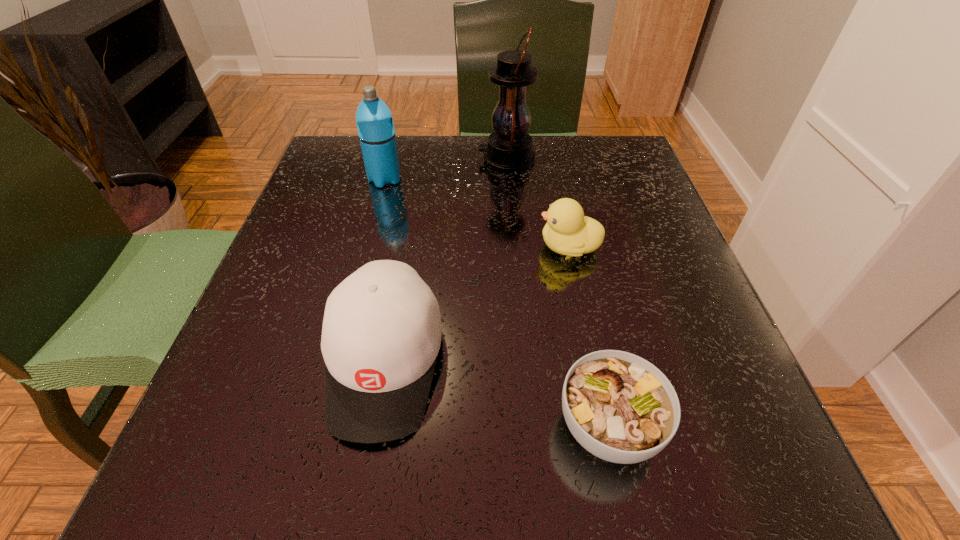
At what (x,y) coordinates should I click in order to perform the action: click on baseball cap at the left edge. Please return your answer as a coordinate pair (x, y). Looking at the image, I should click on (381, 334).

You are a GUI agent. You are given a task and a screenshot of the screen. Output one action in this format:
    pyautogui.click(x=<x>, y=<y>)
    Task: Click on the duckling that is at the right edge
    
    Given the screenshot: What is the action you would take?
    pyautogui.click(x=568, y=232)

What are the coordinates of `soup bowl present at the right edge` in the screenshot? It's located at (621, 408).

Where is `object positioned at the far left corner`? This screenshot has width=960, height=540. object positioned at the far left corner is located at coordinates pos(374,120).

Where is `object that is at the near left corner`? This screenshot has width=960, height=540. object that is at the near left corner is located at coordinates (381, 334).

This screenshot has height=540, width=960. I want to click on object present at the near right corner, so click(621, 408).

Identify the location of vacant region at the far edge of the desktop. The height and width of the screenshot is (540, 960). (533, 147).

You are a GUI agent. You are given a task and a screenshot of the screen. Output one action in this format:
    pyautogui.click(x=<x>, y=<y>)
    Task: Click on the vacant area at the near edge of the desktop
    The height and width of the screenshot is (540, 960).
    Given the screenshot: What is the action you would take?
    pyautogui.click(x=349, y=477)

This screenshot has height=540, width=960. In order to click on blank space at the left edge of the desktop in this screenshot , I will do `click(269, 413)`.

In the image, there is a desktop. What are the coordinates of `free space at the near left corner` in the screenshot? It's located at (212, 501).